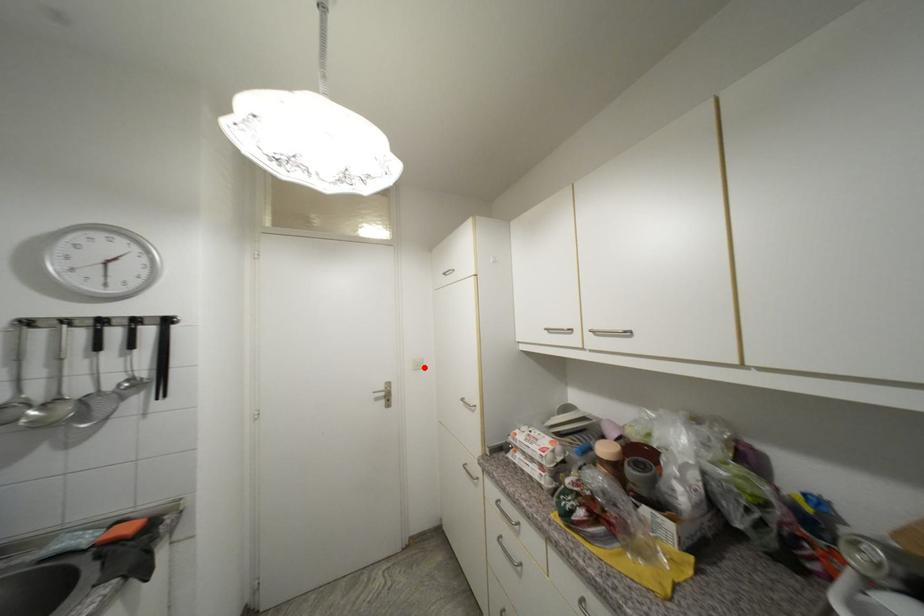
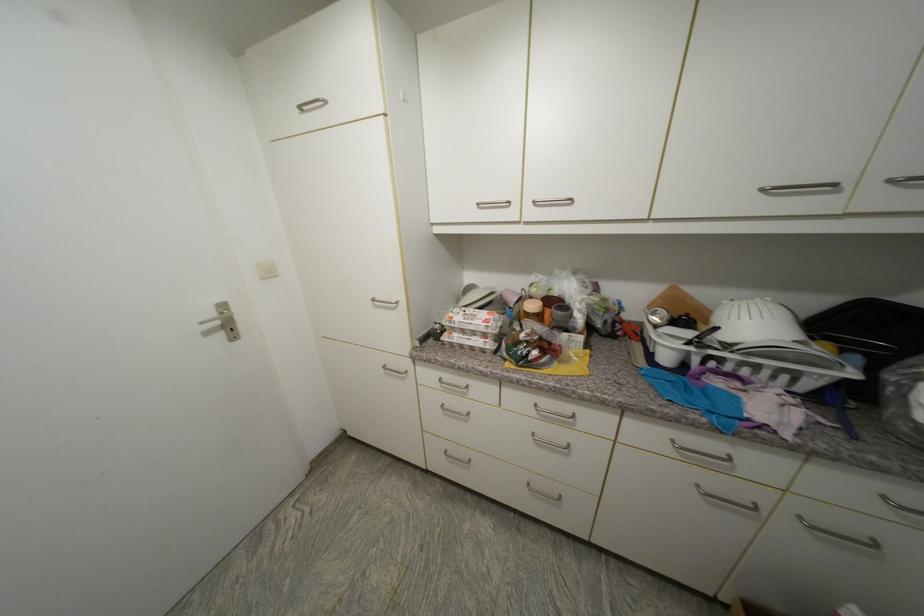
Find the pixel in the second image that matches the highlighted location in the first image.

(274, 275)